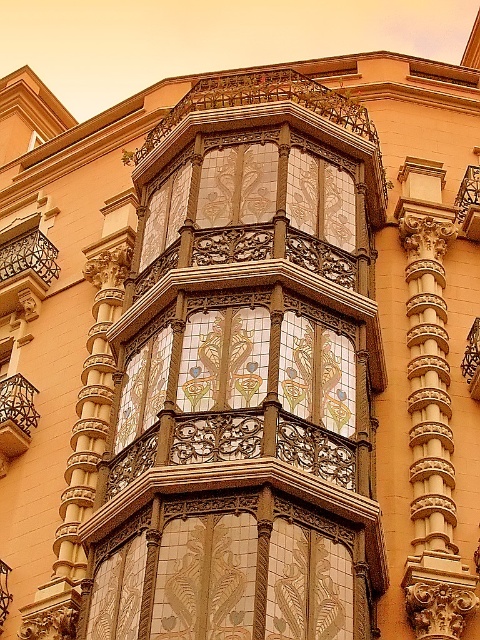
Is point (0, 243) farther from camera compared to point (17, 372)?

That is True.

Is point (31, 236) positioned before point (23, 385)?

No, it is not.

In order to click on black wrought iron balcony at upper left in this screenshot , I will do `click(24, 266)`.